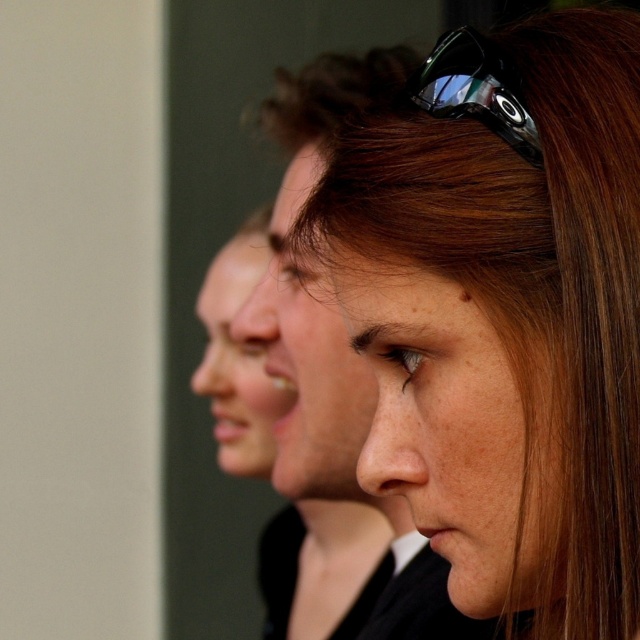
You are taking a photo of the three people in the scene. You notice the brown hair at center and the black plastic sunglasses at upper center. Which object is wider in the image?

The brown hair at center is wider than the black plastic sunglasses at upper center in the image.